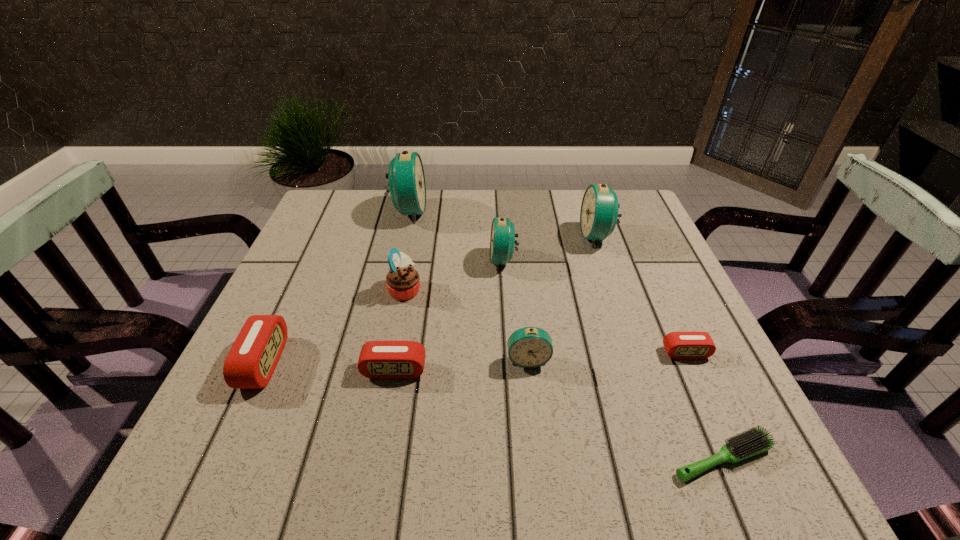
Find the location of `the biggest blue alarm clock`. the biggest blue alarm clock is located at coordinates (407, 186).

In order to click on the tallest alarm clock in this screenshot , I will do (x=407, y=186).

This screenshot has width=960, height=540. In order to click on the eighth shortest object in this screenshot , I will do `click(599, 214)`.

You are a GUI agent. You are given a task and a screenshot of the screen. Output one action in this format:
    pyautogui.click(x=<x>, y=<y>)
    Task: Click on the sixth alarm clock from left to right
    The height and width of the screenshot is (540, 960).
    Given the screenshot: What is the action you would take?
    tap(599, 214)

At what (x,y) coordinates should I click in order to perform the action: click on the third tallest alarm clock. Please return your answer as a coordinate pair (x, y). Looking at the image, I should click on (502, 237).

I want to click on muffin, so click(402, 281).

Where is `pink muffin`? The image size is (960, 540). pink muffin is located at coordinates (402, 281).

At what (x,y) coordinates should I click in order to perform the action: click on the smallest blue alarm clock. Please return your answer as a coordinate pair (x, y). Looking at the image, I should click on (529, 347).

What are the coordinates of `the fourth tallest alarm clock` in the screenshot? It's located at (529, 347).

Find the location of a particular element. Image resolution: width=960 pixels, height=540 pixels. the biggest pink alarm clock is located at coordinates (253, 357).